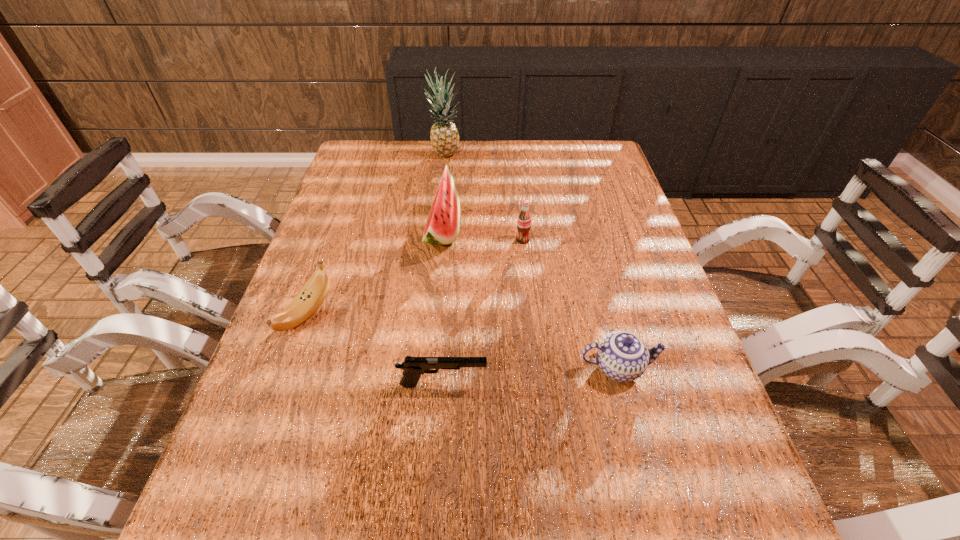
This screenshot has height=540, width=960. I want to click on vacant region located 0.180m on the front of the second object from right to left, so click(528, 293).

Where is `vacant area situated on the front of the leftmost object`? vacant area situated on the front of the leftmost object is located at coordinates (278, 390).

This screenshot has height=540, width=960. I want to click on free space located at the aiming end of the gun, so click(537, 384).

I want to click on object positioned at the far edge, so click(444, 135).

Where is `object present at the left edge`? This screenshot has height=540, width=960. object present at the left edge is located at coordinates (312, 295).

This screenshot has height=540, width=960. I want to click on object at the right edge, so click(x=622, y=356).

Identify the location of vacant region at the far edge. This screenshot has width=960, height=540. (493, 153).

Where is `free space at the near edge of the desktop`? The width and height of the screenshot is (960, 540). free space at the near edge of the desktop is located at coordinates (350, 519).

Find the location of a particular element. free space at the left edge is located at coordinates (254, 478).

This screenshot has height=540, width=960. I want to click on free space at the right edge of the desktop, so click(648, 285).